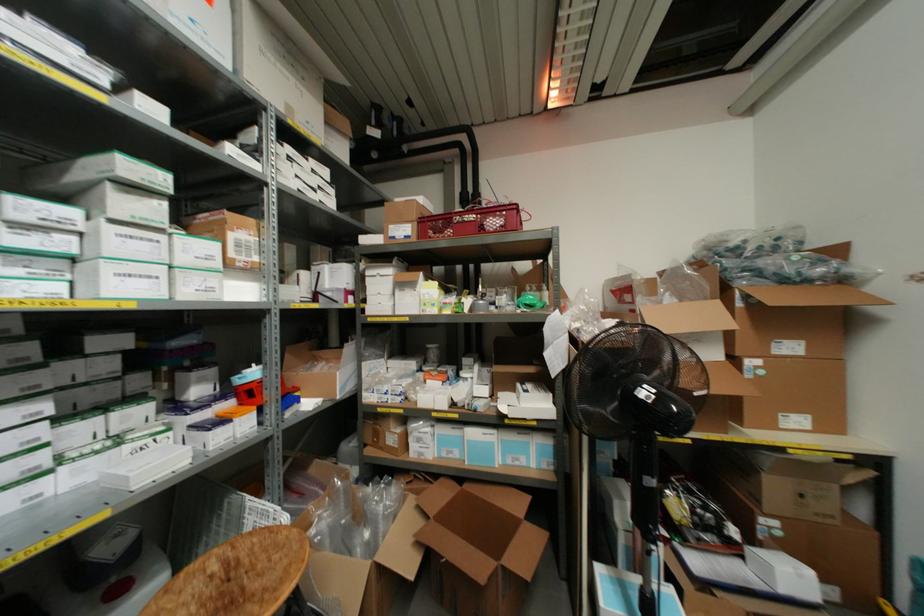
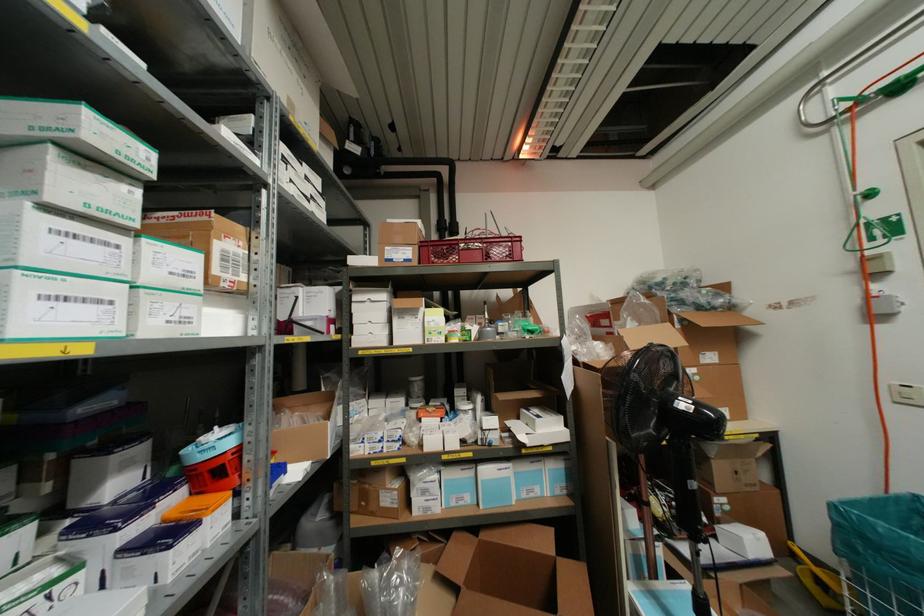
Locate, in the second image, the point that corresponds to point 149,276 in the first image.

(98, 301)